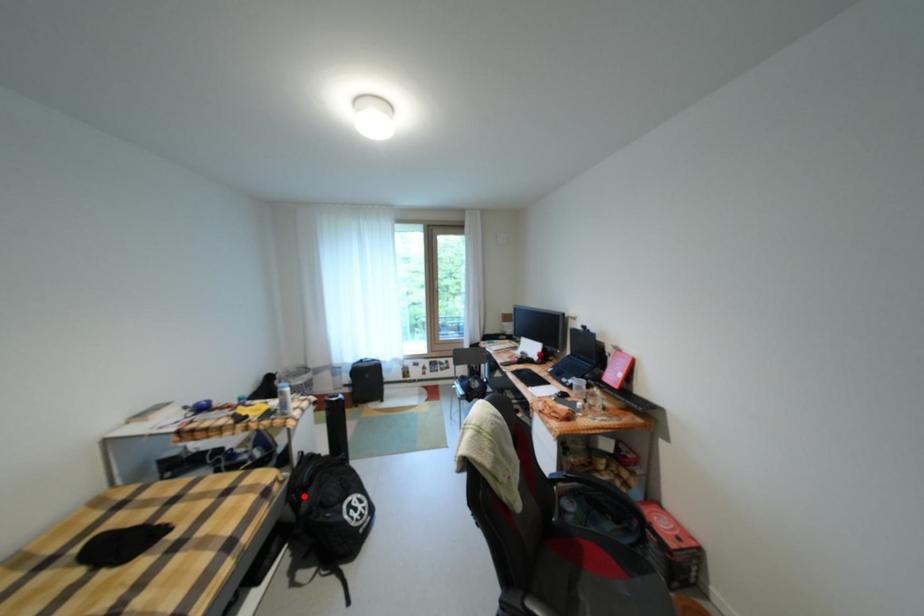
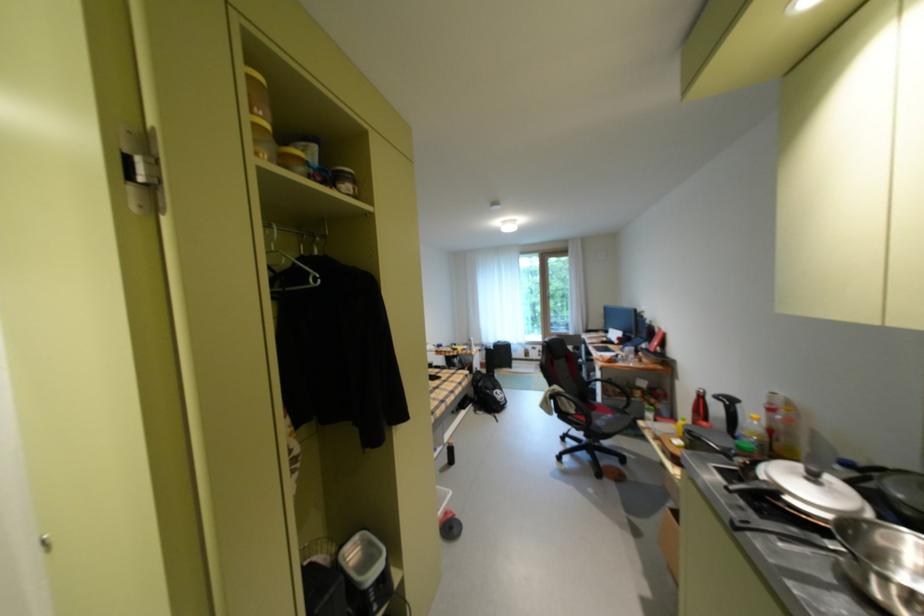
Locate, in the second image, the point that corresponds to the highlighted location in the first image.

(484, 384)